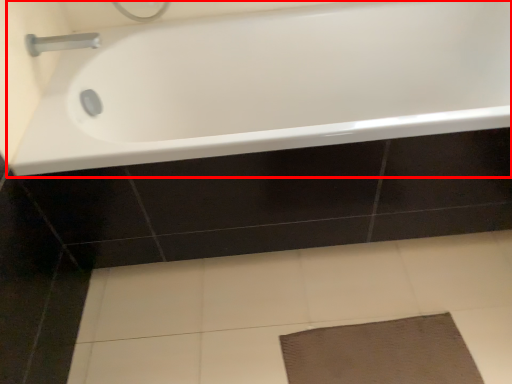
Question: From the image's perspective, where is bathtub (annotated by the red box) located relative to tap?

Choices:
 (A) above
 (B) below

Answer: (B)